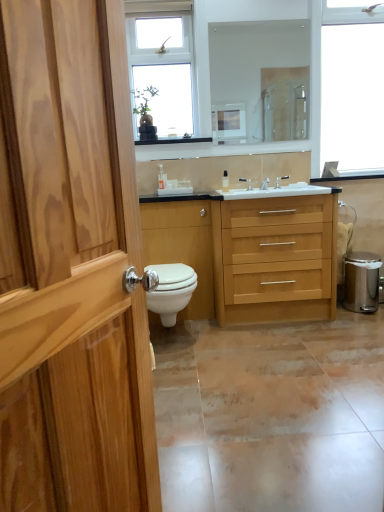
Identify the location of vacant region to the right of white glossy toilet at center. The height and width of the screenshot is (512, 384). (226, 337).